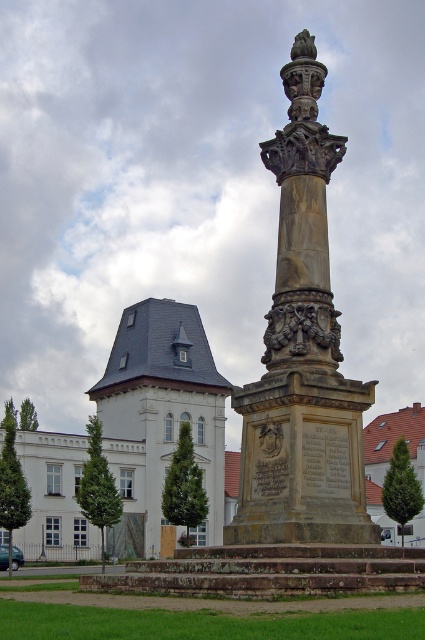
Can you confirm if carved stone column at center is thinner than white stone building at left?

Yes.

Is point (288, 378) less distant than point (217, 461)?

Yes.

You are a GUI agent. You are given a task and a screenshot of the screen. Output one action in this format:
    pyautogui.click(x=<x>, y=<y>)
    Task: Click on the carved stone column at center
    Image resolution: width=425 pixels, height=640 pixels.
    Given the screenshot: What is the action you would take?
    pyautogui.click(x=302, y=353)